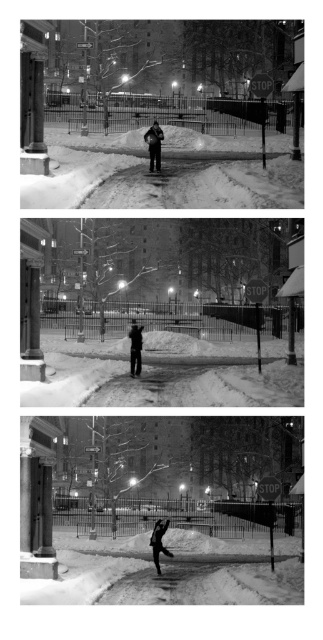
Question: Which object is positioned closest to the dark gray jacket at center?

Choices:
 (A) dark gray fabric jacket at center
 (B) black matte snowboarder at center

Answer: (A)

Question: Considering the relative positions of dark gray jacket at center and black matte snowboarder at center in the image provided, where is dark gray jacket at center located with respect to black matte snowboarder at center?

Choices:
 (A) below
 (B) above

Answer: (B)

Question: Which point is closer to the camera?

Choices:
 (A) dark gray jacket at center
 (B) dark gray fabric jacket at center
 (C) black matte snowboarder at center

Answer: (C)

Question: Can you confirm if dark gray jacket at center is smaller than black matte snowboarder at center?

Choices:
 (A) yes
 (B) no

Answer: (A)

Question: Is dark gray jacket at center thinner than dark gray fabric jacket at center?

Choices:
 (A) no
 (B) yes

Answer: (B)

Question: Among these objects, which one is nearest to the camera?

Choices:
 (A) dark gray jacket at center
 (B) dark gray fabric jacket at center
 (C) black matte snowboarder at center

Answer: (C)